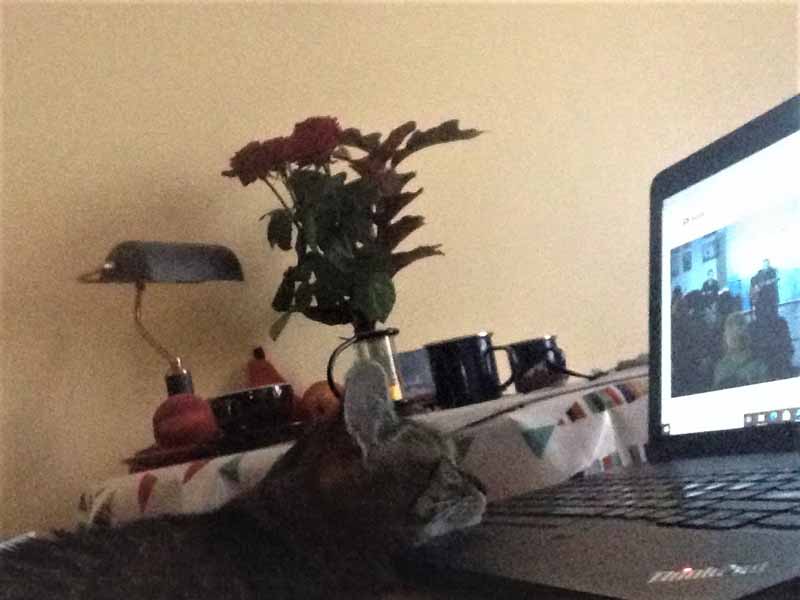
The height and width of the screenshot is (600, 800). I want to click on keyboard of the laptop, so click(x=638, y=494).